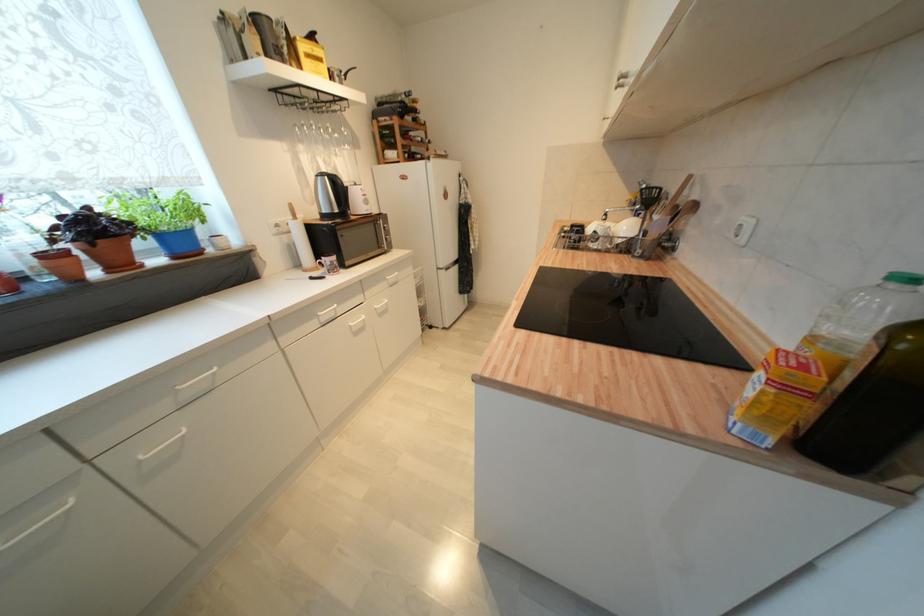
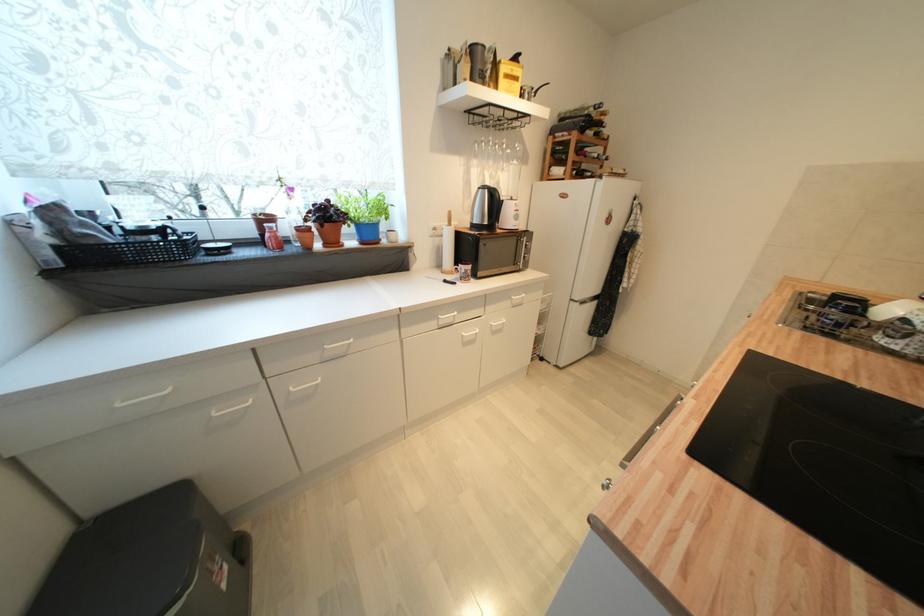
In the second image, find the point that corresponds to pixel 116 272 in the first image.

(331, 246)